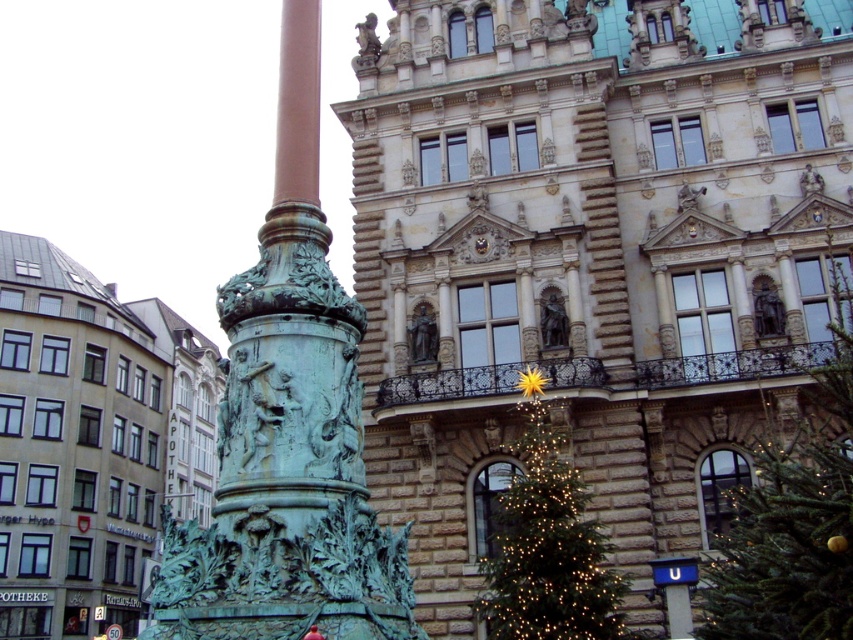
Question: Considering the real-world distances, which object is farthest from the green patina column at center?

Choices:
 (A) green textured christmas tree at center
 (B) green textured christmas tree at lower right

Answer: (A)

Question: Is green patina column at center above green textured christmas tree at center?

Choices:
 (A) no
 (B) yes

Answer: (B)

Question: Which point is farther to the camera?

Choices:
 (A) green textured christmas tree at center
 (B) green patina column at left

Answer: (A)

Question: Can you confirm if green patina column at center is positioned to the left of green textured christmas tree at center?

Choices:
 (A) no
 (B) yes

Answer: (B)

Question: Can you confirm if green patina column at center is wider than green textured christmas tree at center?

Choices:
 (A) no
 (B) yes

Answer: (B)

Question: Which object is closer to the camera taking this photo?

Choices:
 (A) green patina column at left
 (B) green textured christmas tree at center
 (C) green patina column at center

Answer: (A)